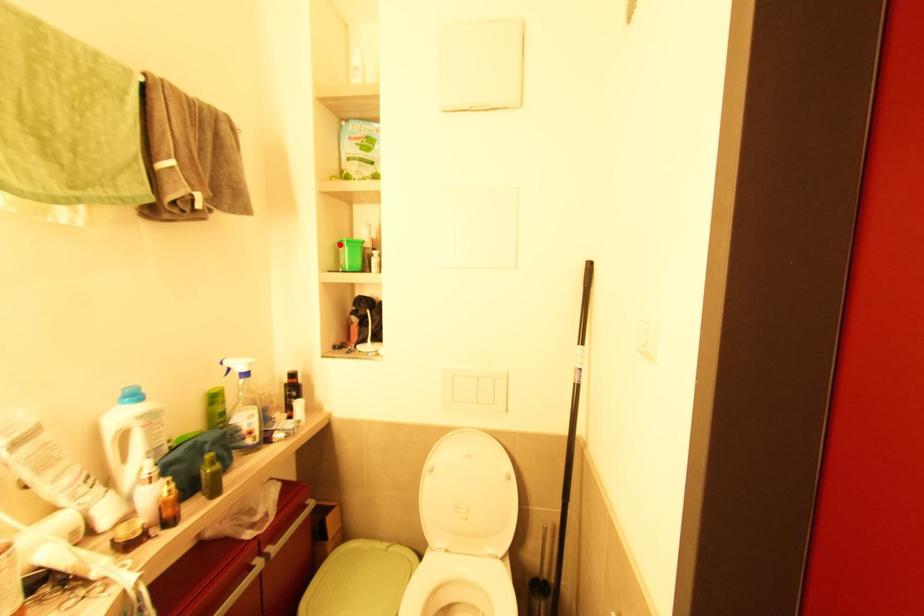
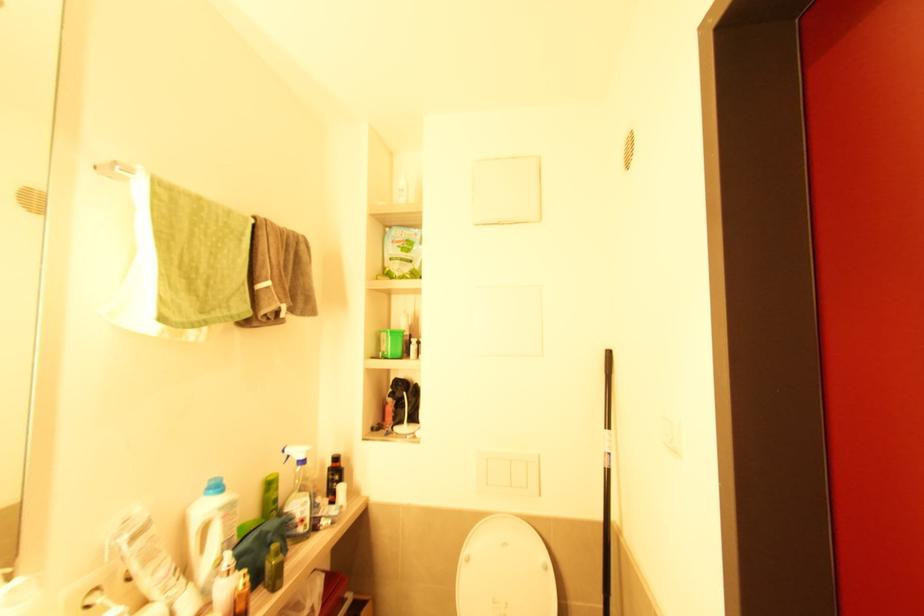
Locate, in the second image, the point that corresponds to the highlighted location in the first image.

(382, 333)